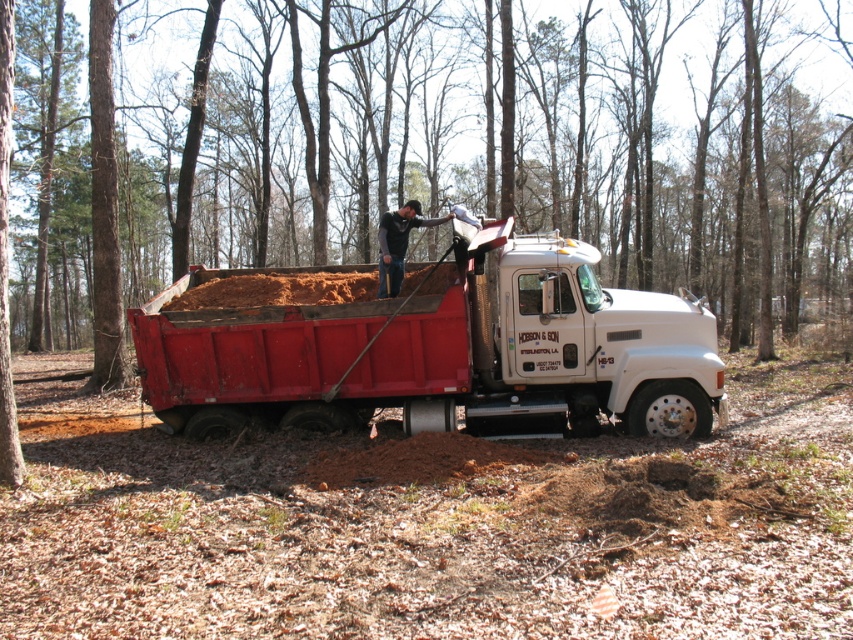
Question: Does matte red dump truck at center appear on the right side of dark gray jeans at center?

Choices:
 (A) yes
 (B) no

Answer: (B)

Question: Does matte red dump truck at center lie behind dark gray jeans at center?

Choices:
 (A) no
 (B) yes

Answer: (A)

Question: Which point is closer to the camera?

Choices:
 (A) (386, 244)
 (B) (515, 51)

Answer: (A)

Question: Which object appears closest to the camera in this image?

Choices:
 (A) matte red dump truck at center
 (B) brown bark tree at center
 (C) dark gray jeans at center

Answer: (A)

Question: Can you confirm if brown bark tree at center is positioned below dark gray jeans at center?

Choices:
 (A) yes
 (B) no

Answer: (B)

Question: Estimate the real-world distances between objects in this image. Which object is closer to the dark gray jeans at center?

Choices:
 (A) brown bark tree at center
 (B) matte red dump truck at center

Answer: (B)